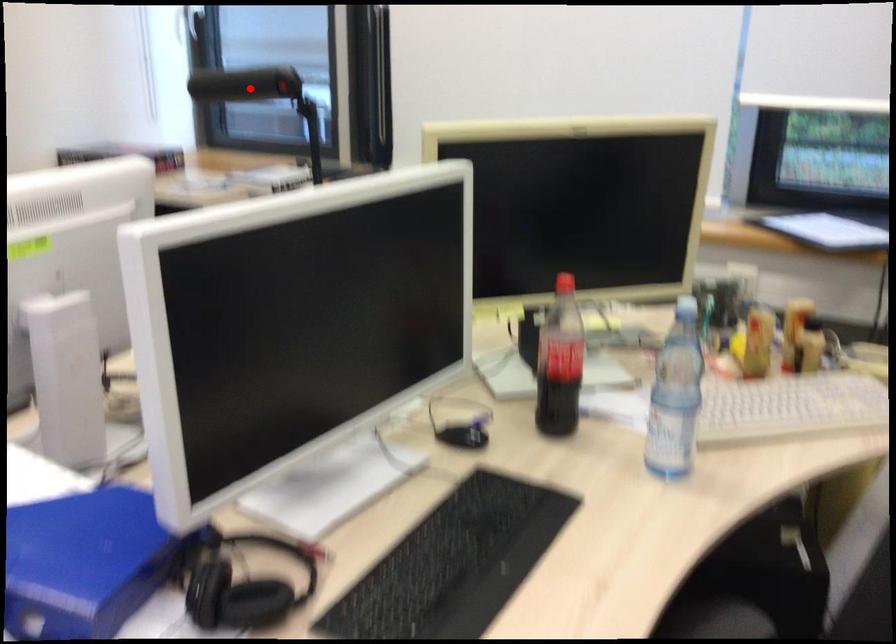
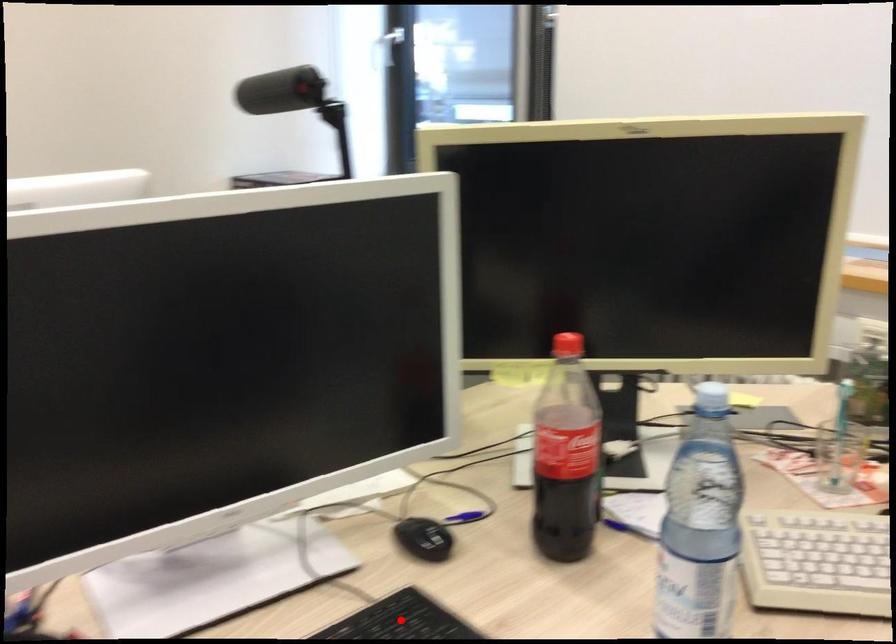
I am providing you with two images of the same scene from different viewpoints. A red point is marked on the first image and another point is marked on the second image. Is the marked point in image1 the same physical position as the marked point in image2?

No